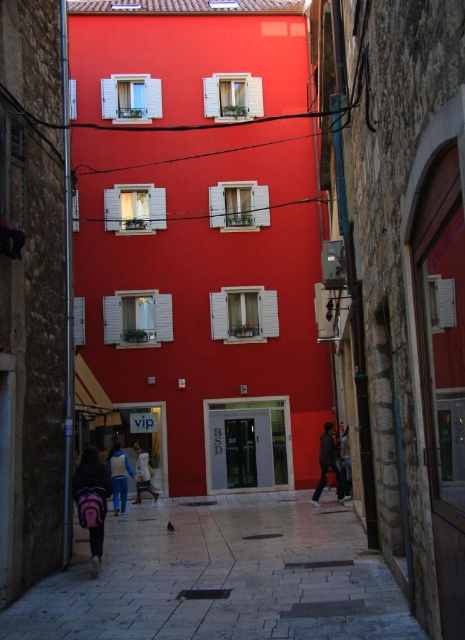
Question: Which point appears farthest from the camera in this image?

Choices:
 (A) (345, 484)
 (B) (154, 572)

Answer: (A)

Question: Does smooth stone pavement at center appear on the right side of blue fabric jacket at lower center?

Choices:
 (A) no
 (B) yes

Answer: (B)

Question: Which point is closer to the camera taking this photo?

Choices:
 (A) (100, 524)
 (B) (314, 492)
 (C) (121, 483)
 (D) (134, 499)

Answer: (A)

Question: Observing the image, what is the correct spatial positioning of dark gray fabric jacket at lower right in reference to white fabric coat at center?

Choices:
 (A) above
 (B) below

Answer: (A)

Question: Can you confirm if white fabric coat at center is positioned below dark blue jeans at center?

Choices:
 (A) no
 (B) yes

Answer: (B)

Question: Among these points, which one is farthest from the camera?

Choices:
 (A) (332, 540)
 (B) (338, 499)
 (C) (140, 492)
 (D) (350, 497)

Answer: (C)